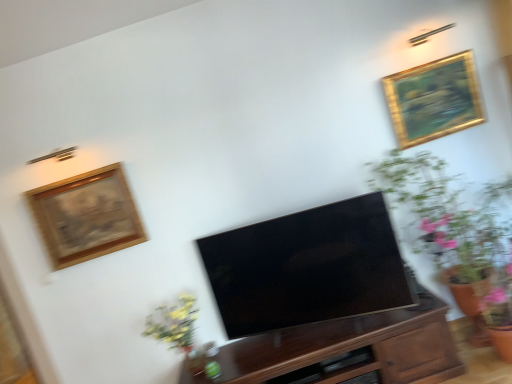
Question: Is wooden drawer at center smaller than dark wood cabinet at center?

Choices:
 (A) yes
 (B) no

Answer: (A)

Question: Considering the relative sizes of wooden drawer at center and dark wood cabinet at center in the image provided, is wooden drawer at center taller than dark wood cabinet at center?

Choices:
 (A) no
 (B) yes

Answer: (A)

Question: Is wooden drawer at center to the left of dark wood cabinet at center from the viewer's perspective?

Choices:
 (A) no
 (B) yes

Answer: (A)

Question: Does wooden drawer at center lie in front of dark wood cabinet at center?

Choices:
 (A) no
 (B) yes

Answer: (A)

Question: From a real-world perspective, is wooden drawer at center under dark wood cabinet at center?

Choices:
 (A) yes
 (B) no

Answer: (A)

Question: From their relative heights in the image, would you say dark wood cabinet at center is taller or shorter than wooden drawer at center?

Choices:
 (A) tall
 (B) short

Answer: (A)

Question: From a real-world perspective, is dark wood cabinet at center positioned above or below wooden drawer at center?

Choices:
 (A) below
 (B) above

Answer: (B)

Question: Is dark wood cabinet at center inside or outside of wooden drawer at center?

Choices:
 (A) outside
 (B) inside

Answer: (A)

Question: From the image's perspective, is dark wood cabinet at center positioned above or below wooden drawer at center?

Choices:
 (A) above
 (B) below

Answer: (A)

Question: From a real-world perspective, is wooden drawer at center positioned above or below gold/gilded picture frame at upper right, placed as the second picture frame when sorted from bottom to top?

Choices:
 (A) below
 (B) above

Answer: (A)

Question: Would you say wooden drawer at center is to the left or to the right of gold/gilded picture frame at upper right, the first picture frame viewed from the top, in the picture?

Choices:
 (A) right
 (B) left

Answer: (B)

Question: Is point (355, 375) positioned closer to the camera than point (418, 125)?

Choices:
 (A) farther
 (B) closer

Answer: (B)

Question: From the image's perspective, relative to gold/gilded picture frame at upper right, the first picture frame viewed from the top, is wooden drawer at center above or below?

Choices:
 (A) below
 (B) above

Answer: (A)

Question: Is gold/gilded picture frame at upper right, the second picture frame from the left, taller or shorter than wooden framed artwork at upper left, the first picture frame positioned from the bottom?

Choices:
 (A) short
 (B) tall

Answer: (A)

Question: From the image's perspective, is gold/gilded picture frame at upper right, placed as the second picture frame when sorted from bottom to top, located above or below wooden framed artwork at upper left, which is counted as the second picture frame, starting from the top?

Choices:
 (A) below
 (B) above

Answer: (B)